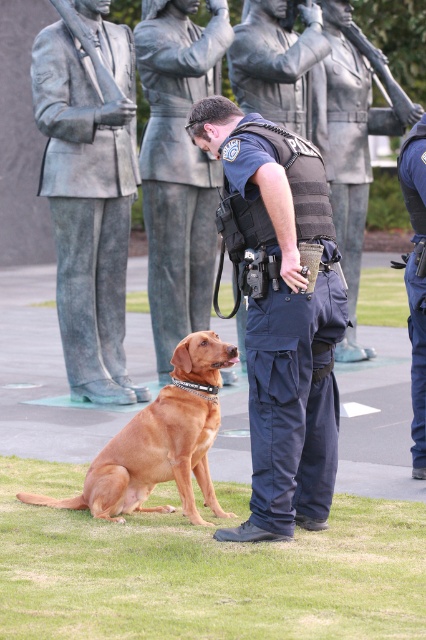
Question: Can you confirm if blue uniform at center is bigger than bronze statue of man at left?

Choices:
 (A) no
 (B) yes

Answer: (A)

Question: Which of these objects is positioned closest to the bronze statue at center?

Choices:
 (A) blue uniform pants at center
 (B) blue uniform at center

Answer: (A)

Question: Which of the following is the closest to the observer?

Choices:
 (A) (213, 205)
 (B) (250, 256)
 (C) (131, 122)
 (D) (198, 369)

Answer: (B)

Question: Considering the real-world distances, which object is closest to the golden brown fur at center?

Choices:
 (A) bronze statue of man at left
 (B) blue uniform pants at center

Answer: (B)

Question: Is brushed metal statue at center thinner than blue uniform pants at center?

Choices:
 (A) no
 (B) yes

Answer: (A)

Question: Observing the image, what is the correct spatial positioning of bronze statue at center in reference to blue uniform pants at center?

Choices:
 (A) below
 (B) above

Answer: (B)